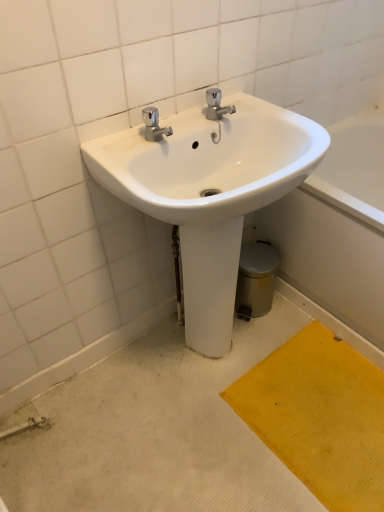
The image size is (384, 512). I want to click on vacant space in front of white glossy sink at center, so click(x=225, y=453).